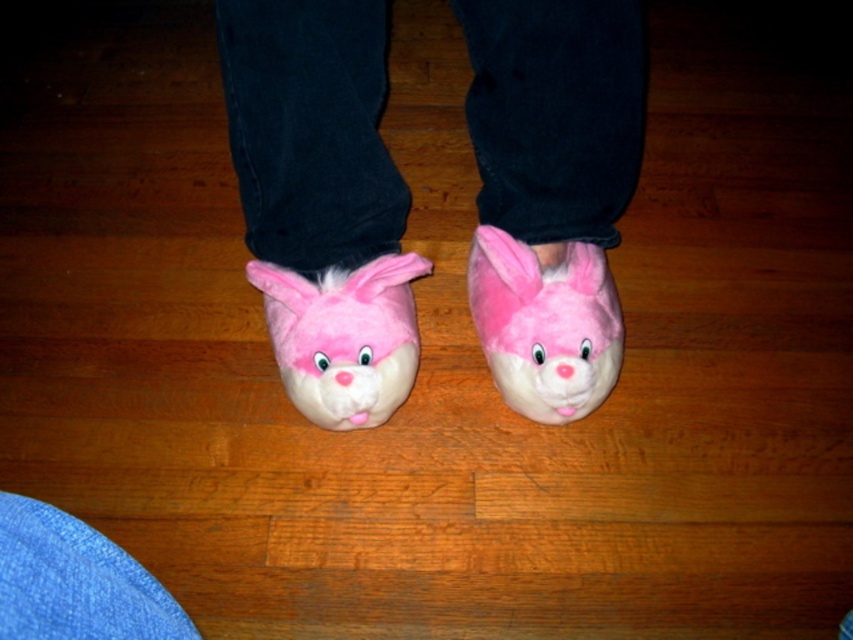
Can you confirm if fluffy pink slippers at center is positioned to the left of fluffy pink plush bunny at center?

In fact, fluffy pink slippers at center is to the right of fluffy pink plush bunny at center.

Does point (306, 104) lie in front of point (289, 388)?

Yes, point (306, 104) is in front of point (289, 388).

Locate an element on the screen. fluffy pink slippers at center is located at coordinates (322, 200).

Is point (381, 76) farther from viewer compared to point (607, 280)?

No, it is not.

How far apart are fluffy pink slippers at center and fluffy pink plush at center?

fluffy pink slippers at center is 3.76 inches from fluffy pink plush at center.

Where is `fluffy pink slippers at center`? fluffy pink slippers at center is located at coordinates (322, 200).

Between fluffy pink plush at center and fluffy pink plush bunny at center, which one appears on the left side from the viewer's perspective?

Positioned to the left is fluffy pink plush bunny at center.

Does point (575, 372) lie in front of point (392, 292)?

Yes, point (575, 372) is closer to viewer.

Does point (485, 301) come in front of point (410, 333)?

No, it is behind (410, 333).

Image resolution: width=853 pixels, height=640 pixels. In order to click on fluffy pink plush at center in this screenshot , I will do `click(544, 324)`.